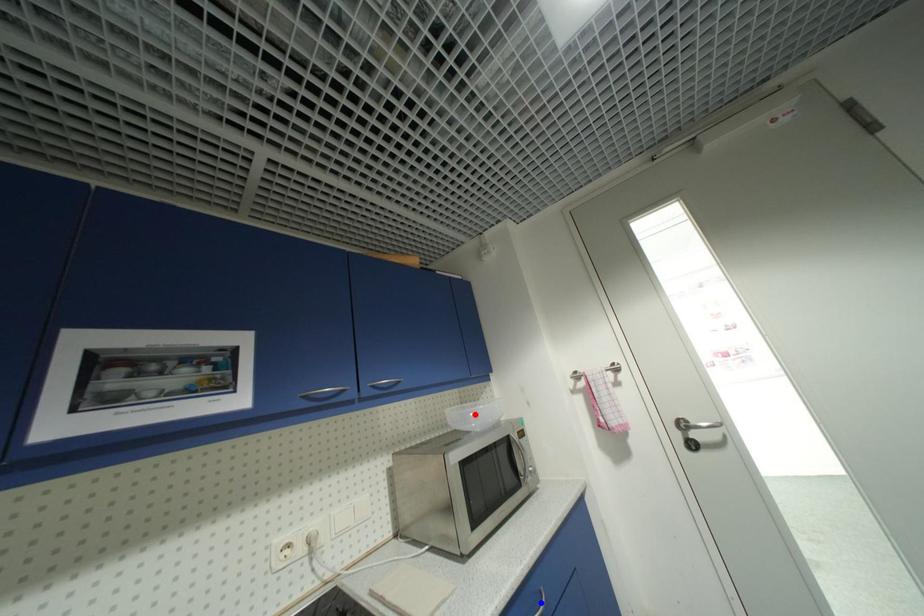
Question: Which of the two points in the image is closer to the camera?

Choices:
 (A) Blue point is closer.
 (B) Red point is closer.

Answer: (A)